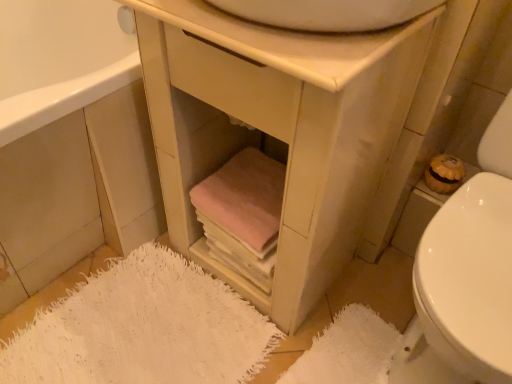
Describe the element at coordinates (285, 41) in the screenshot. This screenshot has width=512, height=384. I see `white glossy sink at upper center` at that location.

Identify the location of white fuzzy bath mat at lower left, which is counted as the second bath mat, starting from the right. This screenshot has height=384, width=512. (142, 329).

Measure the distance between white textured bath mat at lower right, the 1th bath mat positioned from the right, and camera.

They are 3.40 feet apart.

You are a GUI agent. You are given a task and a screenshot of the screen. Output one action in this format:
    pyautogui.click(x=<x>, y=<y>)
    Task: Click on the white glossy sink at upper center
    This screenshot has width=512, height=384.
    Given the screenshot: What is the action you would take?
    pyautogui.click(x=285, y=41)

Is white glossy sink at upper center with matte brown toilet paper at right?

No, white glossy sink at upper center is not beside matte brown toilet paper at right.

Considering the sizes of objects white glossy sink at upper center and matte brown toilet paper at right in the image provided, who is shorter, white glossy sink at upper center or matte brown toilet paper at right?

white glossy sink at upper center is shorter.

Considering the relative positions of white glossy sink at upper center and matte brown toilet paper at right in the image provided, is white glossy sink at upper center in front of matte brown toilet paper at right?

Yes, it is in front of matte brown toilet paper at right.

Who is smaller, white glossy sink at upper center or matte brown toilet paper at right?

With smaller size is matte brown toilet paper at right.

From the picture: Considering the relative positions of white fuzzy bath mat at lower left, which is counted as the second bath mat, starting from the right, and white glossy toilet at lower right in the image provided, is white fuzzy bath mat at lower left, which is counted as the second bath mat, starting from the right, behind white glossy toilet at lower right?

Yes, white fuzzy bath mat at lower left, which is counted as the second bath mat, starting from the right, is further from the viewer.

In terms of width, does white fuzzy bath mat at lower left, which is counted as the second bath mat, starting from the right, look wider or thinner when compared to white glossy toilet at lower right?

Considering their sizes, white fuzzy bath mat at lower left, which is counted as the second bath mat, starting from the right, looks slimmer than white glossy toilet at lower right.

From the image's perspective, does white fuzzy bath mat at lower left, arranged as the first bath mat when viewed from the left, appear lower than white glossy toilet at lower right?

Indeed, from the image's perspective, white fuzzy bath mat at lower left, arranged as the first bath mat when viewed from the left, is shown beneath white glossy toilet at lower right.

In terms of size, does white fuzzy bath mat at lower left, arranged as the first bath mat when viewed from the left, appear bigger or smaller than white glossy toilet at lower right?

In the image, white fuzzy bath mat at lower left, arranged as the first bath mat when viewed from the left, appears to be smaller than white glossy toilet at lower right.

From a real-world perspective, who is located lower, matte brown toilet paper at right or matte wood cabinet at lower left?

matte wood cabinet at lower left, from a real-world perspective.

Who is bigger, matte brown toilet paper at right or matte wood cabinet at lower left?

With larger size is matte wood cabinet at lower left.

Is matte brown toilet paper at right facing towards matte wood cabinet at lower left?

No, matte brown toilet paper at right does not turn towards matte wood cabinet at lower left.

In terms of size, does white glossy toilet at lower right appear bigger or smaller than white textured bath mat at lower right, the 1th bath mat positioned from the right?

Clearly, white glossy toilet at lower right is larger in size than white textured bath mat at lower right, the 1th bath mat positioned from the right.

Between point (419, 375) and point (378, 329), which one is positioned behind?

The point (378, 329) is behind.

Which object is thinner, white glossy toilet at lower right or white textured bath mat at lower right, the 1th bath mat positioned from the right?

white textured bath mat at lower right, the 1th bath mat positioned from the right, is thinner.

Based on the photo, from a real-world perspective, between white glossy toilet at lower right and white textured bath mat at lower right, the 2th bath mat positioned from the left, who is vertically lower?

In real-world perspective, white textured bath mat at lower right, the 2th bath mat positioned from the left, is lower.

Locate an element on the screen. The height and width of the screenshot is (384, 512). vanity that appears on the right of pink fabric towels at lower center is located at coordinates (272, 142).

Is pink fabric towels at lower center located outside matte white vanity at center?

No, pink fabric towels at lower center is inside or overlapping with matte white vanity at center.

Considering the sizes of pink fabric towels at lower center and matte white vanity at center in the image, is pink fabric towels at lower center wider or thinner than matte white vanity at center?

pink fabric towels at lower center is thinner than matte white vanity at center.

Is matte white vanity at center at the back of pink fabric towels at lower center?

Yes, pink fabric towels at lower center is positioned with its back facing matte white vanity at center.

Is point (334, 174) closer to viewer compared to point (439, 174)?

That is True.

Considering their positions, is matte white vanity at center located in front of or behind matte brown toilet paper at right?

Clearly, matte white vanity at center is in front of matte brown toilet paper at right.

Can you confirm if matte white vanity at center is shorter than matte brown toilet paper at right?

In fact, matte white vanity at center may be taller than matte brown toilet paper at right.

Is matte white vanity at center at the right side of matte brown toilet paper at right?

Incorrect, matte white vanity at center is not on the right side of matte brown toilet paper at right.

Locate an element on the screen. the 1st bath mat located beneath the matte wood cabinet at lower left (from a real-world perspective) is located at coordinates (348, 351).

Is white textured bath mat at lower right, the 1th bath mat positioned from the right, positioned with its back to matte wood cabinet at lower left?

Correct, white textured bath mat at lower right, the 1th bath mat positioned from the right, is looking away from matte wood cabinet at lower left.

From the image's perspective, who appears lower, white textured bath mat at lower right, the 2th bath mat positioned from the left, or matte wood cabinet at lower left?

white textured bath mat at lower right, the 2th bath mat positioned from the left.

The width and height of the screenshot is (512, 384). I want to click on toilet paper that appears below the white glossy sink at upper center (from a real-world perspective), so click(444, 174).

This screenshot has height=384, width=512. I want to click on toilet in front of the white fuzzy bath mat at lower left, arranged as the first bath mat when viewed from the left, so click(466, 277).

Based on their spatial positions, is white textured bath mat at lower right, the 2th bath mat positioned from the left, or matte brown toilet paper at right further from white fuzzy bath mat at lower left, which is counted as the second bath mat, starting from the right?

matte brown toilet paper at right is positioned further to the anchor white fuzzy bath mat at lower left, which is counted as the second bath mat, starting from the right.

Looking at the image, which one is located further to matte wood cabinet at lower left, white textured bath mat at lower right, the 2th bath mat positioned from the left, or white glossy sink at upper center?

white textured bath mat at lower right, the 2th bath mat positioned from the left, is positioned further to the anchor matte wood cabinet at lower left.

Which object lies nearer to the anchor point white glossy toilet at lower right, white glossy sink at upper center or matte brown toilet paper at right?

matte brown toilet paper at right is closer to white glossy toilet at lower right.

Which object lies nearer to the anchor point pink fabric towels at lower center, matte brown toilet paper at right or matte white vanity at center?

matte white vanity at center lies closer to pink fabric towels at lower center than the other object.

Estimate the real-world distances between objects in this image. Which object is closer to matte wood cabinet at lower left, white glossy toilet at lower right or white fuzzy bath mat at lower left, arranged as the first bath mat when viewed from the left?

white fuzzy bath mat at lower left, arranged as the first bath mat when viewed from the left.

From the image, which object appears to be farther from matte wood cabinet at lower left, white fuzzy bath mat at lower left, which is counted as the second bath mat, starting from the right, or matte brown toilet paper at right?

The object further to matte wood cabinet at lower left is matte brown toilet paper at right.

From the picture: Based on their spatial positions, is white glossy toilet at lower right or white glossy sink at upper center closer to white fuzzy bath mat at lower left, which is counted as the second bath mat, starting from the right?

white glossy toilet at lower right is closer to white fuzzy bath mat at lower left, which is counted as the second bath mat, starting from the right.

Considering their positions, is pink fabric towels at lower center positioned closer to matte wood cabinet at lower left than white glossy sink at upper center?

pink fabric towels at lower center lies closer to matte wood cabinet at lower left than the other object.

Find the location of a particular element. This screenshot has height=384, width=512. bath mat between matte white vanity at center and white textured bath mat at lower right, the 1th bath mat positioned from the right, in the up-down direction is located at coordinates (142, 329).

At what (x,y) coordinates should I click in order to perform the action: click on toilet between white glossy sink at upper center and white textured bath mat at lower right, the 1th bath mat positioned from the right, in the vertical direction. Please return your answer as a coordinate pair (x, y). This screenshot has width=512, height=384. Looking at the image, I should click on (466, 277).

Locate an element on the screen. bath mat between white fuzzy bath mat at lower left, which is counted as the second bath mat, starting from the right, and white glossy toilet at lower right, in the horizontal direction is located at coordinates (348, 351).

You are a GUI agent. You are given a task and a screenshot of the screen. Output one action in this format:
    pyautogui.click(x=<x>, y=<y>)
    Task: Click on the counter top between matte wood cabinet at lower left and white glossy toilet at lower right
    
    Given the screenshot: What is the action you would take?
    pyautogui.click(x=285, y=41)